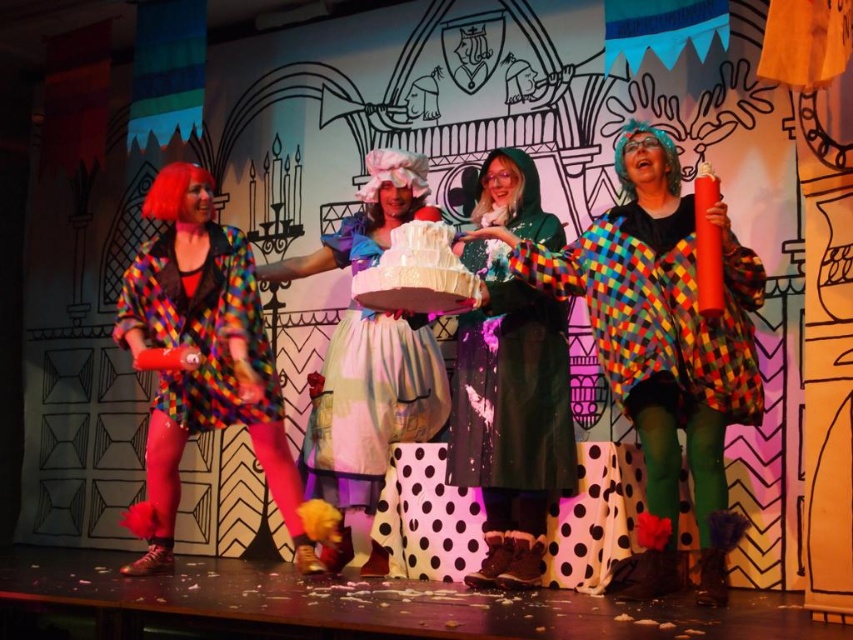
You are a costume designer who needs to store the green woolen coat at center and the multicolored patchwork coat at left in a wardrobe. Which coat will require more space due to its size?

The green woolen coat at center is bigger than the multicolored patchwork coat at left, so it will require more space in the wardrobe.

You are a stagehand preparing to place a spotlight on the stage. The spotlight can only illuminate an area within a radius of 0.5 units from its center. If you position the spotlight at the center of the stage, which is at point 0.5, 0.5, will the green woolen coat at center be illuminated by the spotlight?

The green woolen coat at center is located at point (x=509, y=416). The distance from the spotlight center at (x=426, y=320) to the coat is sqrt of squared differences in coordinates. Calculating sqrt of 0.15 squared plus 0.099 squared equals sqrt of 0.0225 plus 0.0098 equals sqrt of 0.0323 which is approximately 0.18 units. Since 0.18 is less than 0.5, the coat will be illuminated.